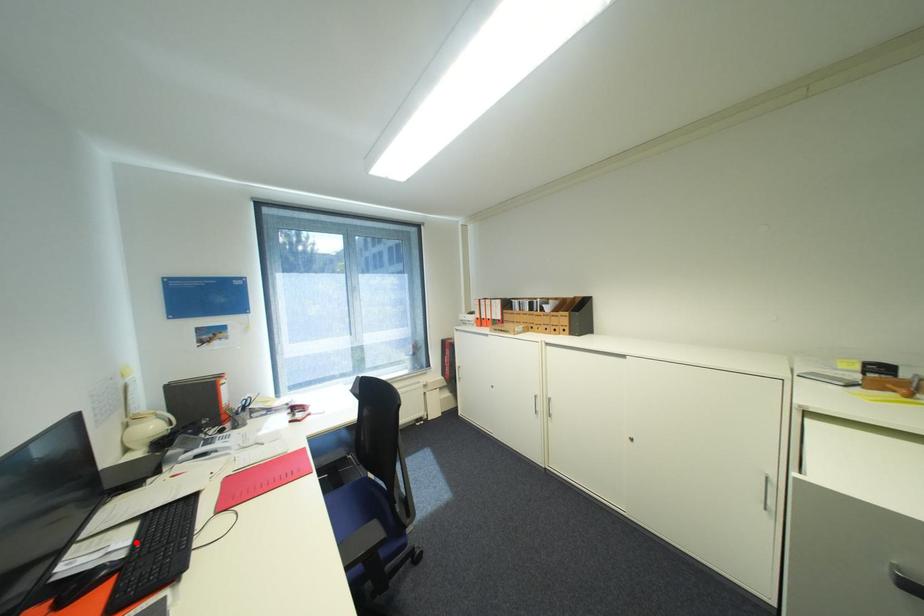
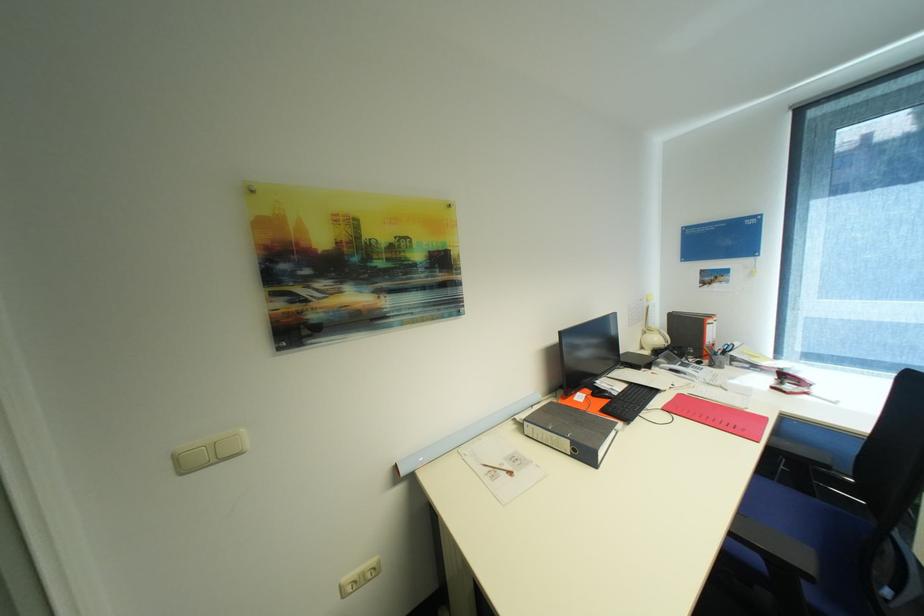
Find the pixel in the second image that matches the highlighted location in the first image.

(627, 391)